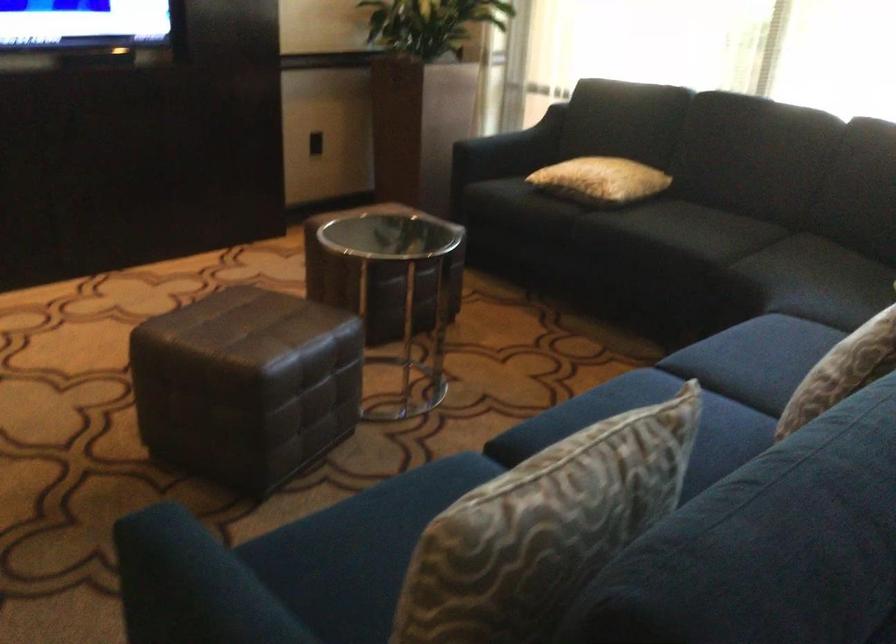
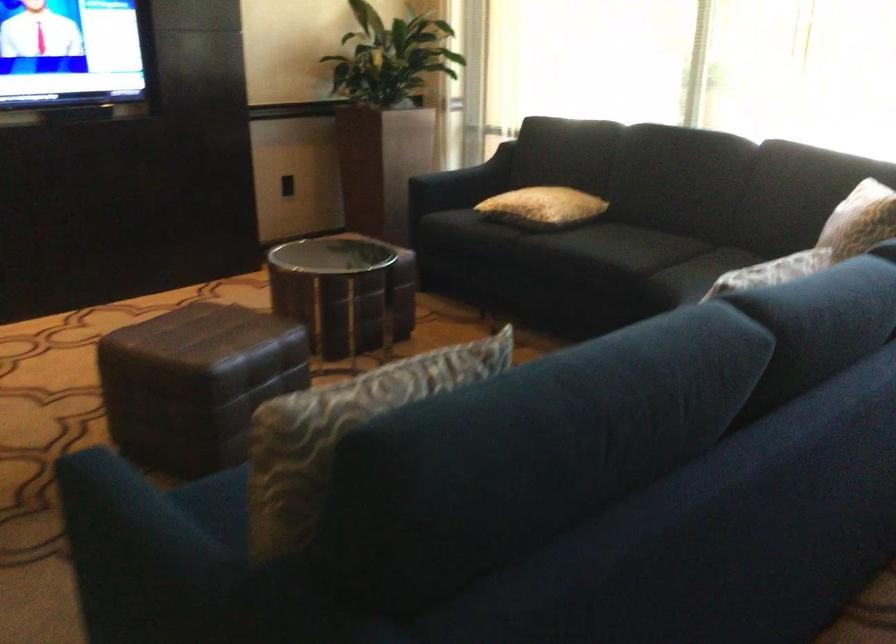
Where in the second image is the point corresponding to (702,240) from the first image?

(626, 254)